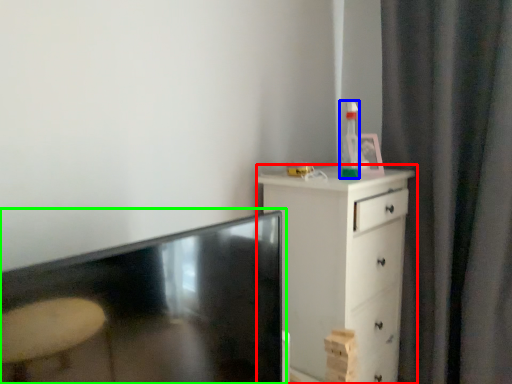
Question: Which is farther away from chest of drawers (highlighted by a red box)? bottle (highlighted by a blue box) or table (highlighted by a green box)?

Choices:
 (A) bottle
 (B) table

Answer: (B)